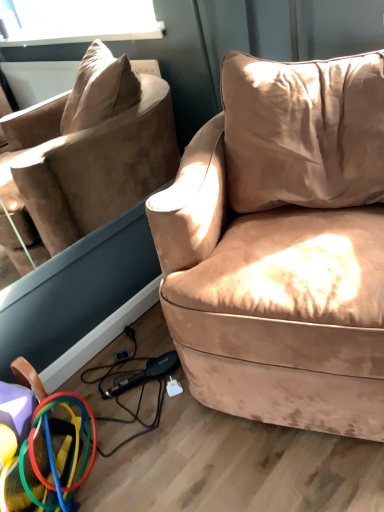
Question: Can you confirm if beige velvet pillow at upper right is positioned to the left of rubberized plastic rings at lower left?

Choices:
 (A) no
 (B) yes

Answer: (A)

Question: From the image's perspective, would you say beige velvet pillow at upper right is shown under rubberized plastic rings at lower left?

Choices:
 (A) yes
 (B) no

Answer: (B)

Question: Would you say beige velvet pillow at upper right contains rubberized plastic rings at lower left?

Choices:
 (A) no
 (B) yes

Answer: (A)

Question: Can you confirm if beige velvet pillow at upper right is thinner than rubberized plastic rings at lower left?

Choices:
 (A) yes
 (B) no

Answer: (B)

Question: Is beige velvet pillow at upper right positioned far away from rubberized plastic rings at lower left?

Choices:
 (A) no
 (B) yes

Answer: (A)

Question: In terms of width, does rubberized plastic rings at lower left look wider or thinner when compared to beige velvet pillow at upper right?

Choices:
 (A) thin
 (B) wide

Answer: (A)

Question: Is rubberized plastic rings at lower left inside the boundaries of beige velvet pillow at upper right, or outside?

Choices:
 (A) outside
 (B) inside

Answer: (A)

Question: Is rubberized plastic rings at lower left to the left or to the right of beige velvet pillow at upper right in the image?

Choices:
 (A) right
 (B) left

Answer: (B)

Question: From the image's perspective, relative to beige velvet pillow at upper right, is rubberized plastic rings at lower left above or below?

Choices:
 (A) below
 (B) above

Answer: (A)

Question: Would you say suede-like beige couch at center-right is to the left or to the right of beige velvet pillow at upper right in the picture?

Choices:
 (A) right
 (B) left

Answer: (B)

Question: Considering the positions of point (246, 203) and point (299, 74), is point (246, 203) closer or farther from the camera than point (299, 74)?

Choices:
 (A) farther
 (B) closer

Answer: (A)

Question: Is suede-like beige couch at center-right in front of or behind beige velvet pillow at upper right in the image?

Choices:
 (A) front
 (B) behind

Answer: (A)

Question: Based on their sizes in the image, would you say suede-like beige couch at center-right is bigger or smaller than beige velvet pillow at upper right?

Choices:
 (A) big
 (B) small

Answer: (A)

Question: Considering their positions, is suede-like beige couch at center-right located in front of or behind rubberized plastic rings at lower left?

Choices:
 (A) front
 (B) behind

Answer: (A)

Question: Does point (352, 98) appear closer or farther from the camera than point (72, 490)?

Choices:
 (A) closer
 (B) farther

Answer: (A)